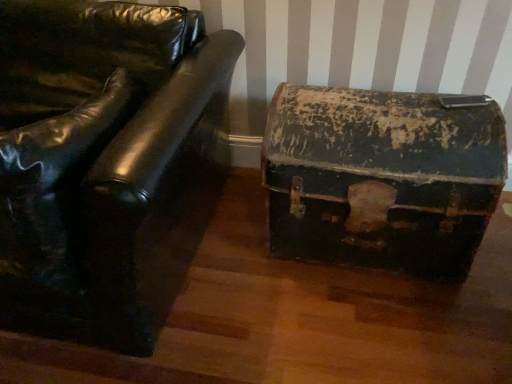
Question: Based on their positions, is rusty metal trunk at right located to the left or right of matte black leather couch at left?

Choices:
 (A) right
 (B) left

Answer: (A)

Question: In terms of height, does rusty metal trunk at right look taller or shorter compared to matte black leather couch at left?

Choices:
 (A) short
 (B) tall

Answer: (A)

Question: Choose the correct answer: Is rusty metal trunk at right inside matte black leather couch at left or outside it?

Choices:
 (A) inside
 (B) outside

Answer: (B)

Question: Is matte black leather couch at left inside or outside of rusty metal trunk at right?

Choices:
 (A) outside
 (B) inside

Answer: (A)

Question: Considering the positions of point (221, 61) and point (346, 140), is point (221, 61) closer or farther from the camera than point (346, 140)?

Choices:
 (A) closer
 (B) farther

Answer: (B)

Question: Considering the positions of matte black leather couch at left and rusty metal trunk at right in the image, is matte black leather couch at left taller or shorter than rusty metal trunk at right?

Choices:
 (A) tall
 (B) short

Answer: (A)

Question: From the image's perspective, is matte black leather couch at left above or below rusty metal trunk at right?

Choices:
 (A) below
 (B) above

Answer: (B)